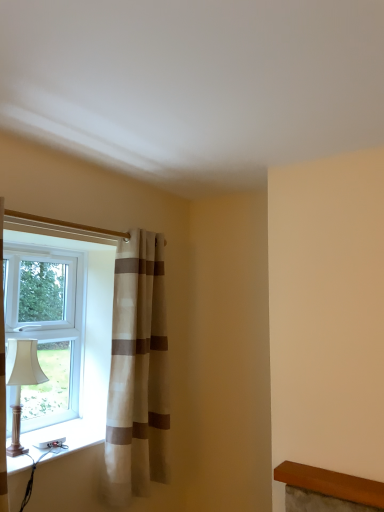
The width and height of the screenshot is (384, 512). I want to click on white plastic window sill at lower left, so click(x=66, y=436).

The height and width of the screenshot is (512, 384). Identify the location of beige striped curtain at left. (138, 372).

Locate an element on the screen. The height and width of the screenshot is (512, 384). matte white lampshade at left is located at coordinates (21, 382).

Considering the points (156, 277) and (77, 346), which point is behind, point (156, 277) or point (77, 346)?

Point (77, 346)

Is white plastic window at left at the back of beige striped curtain at left?

Absolutely, beige striped curtain at left is directed away from white plastic window at left.

From a real-world perspective, is beige striped curtain at left under white plastic window at left?

Yes, from a real-world perspective, beige striped curtain at left is beneath white plastic window at left.

How different are the orientations of matte white lampshade at left and beige striped curtain at left in degrees?

The angular difference between matte white lampshade at left and beige striped curtain at left is 0.0033 degrees.

From the image's perspective, which is above, matte white lampshade at left or beige striped curtain at left?

beige striped curtain at left, from the image's perspective.

Considering the sizes of objects matte white lampshade at left and beige striped curtain at left in the image provided, who is bigger, matte white lampshade at left or beige striped curtain at left?

beige striped curtain at left is bigger.

Is matte white lampshade at left positioned with its back to beige striped curtain at left?

No.

Is white plastic window sill at lower left bigger or smaller than matte white lampshade at left?

Considering their sizes, white plastic window sill at lower left takes up less space than matte white lampshade at left.

Is point (51, 455) positioned in front of point (27, 353)?

That is True.

Is white plastic window sill at lower left situated inside matte white lampshade at left or outside?

The correct answer is: outside.

Is white plastic window sill at lower left turned away from matte white lampshade at left?

That's not correct — white plastic window sill at lower left is not looking away from matte white lampshade at left.

From a real-world perspective, is white plastic window sill at lower left under beige striped curtain at left?

Indeed, from a real-world perspective, white plastic window sill at lower left is positioned beneath beige striped curtain at left.

Is white plastic window sill at lower left aimed at beige striped curtain at left?

No, white plastic window sill at lower left is not facing towards beige striped curtain at left.

Is white plastic window sill at lower left further to the viewer compared to beige striped curtain at left?

No, white plastic window sill at lower left is in front of beige striped curtain at left.

Considering the positions of objects white plastic window sill at lower left and beige striped curtain at left in the image provided, who is more to the left, white plastic window sill at lower left or beige striped curtain at left?

From the viewer's perspective, white plastic window sill at lower left appears more on the left side.

From the image's perspective, does white plastic window sill at lower left appear higher than white plastic window at left?

No, from the image's perspective, white plastic window sill at lower left is not above white plastic window at left.

Is white plastic window sill at lower left wider than white plastic window at left?

Yes, white plastic window sill at lower left is wider than white plastic window at left.

In the image, there is a white plastic window sill at lower left. Identify the location of window above it (from the image's perspective). Image resolution: width=384 pixels, height=512 pixels. (62, 325).

Considering their positions, is matte white lampshade at left located in front of or behind white plastic window at left?

Visually, matte white lampshade at left is located in front of white plastic window at left.

The image size is (384, 512). Identify the location of window located on the left of matte white lampshade at left. (62, 325).

Which of these two, matte white lampshade at left or white plastic window at left, is smaller?

matte white lampshade at left is smaller.

From the image's perspective, is matte white lampshade at left above or below white plastic window at left?

From the image's perspective, matte white lampshade at left appears below white plastic window at left.

Are white plastic window at left and beige striped curtain at left located far from each other?

No, white plastic window at left is in close proximity to beige striped curtain at left.

From a real-world perspective, which is physically above, white plastic window at left or beige striped curtain at left?

In real-world perspective, white plastic window at left is above.

How different are the orientations of white plastic window at left and beige striped curtain at left in degrees?

The facing directions of white plastic window at left and beige striped curtain at left are 0.00238 degrees apart.

Which of these two, white plastic window at left or beige striped curtain at left, is smaller?

With smaller size is white plastic window at left.

Image resolution: width=384 pixels, height=512 pixels. What are the coordinates of `window that appears above the beige striped curtain at left (from the image's perspective)` in the screenshot? It's located at (62, 325).

Identify the location of curtain that is behind the matte white lampshade at left. Image resolution: width=384 pixels, height=512 pixels. (138, 372).

From the image, which object appears to be farther from beige striped curtain at left, matte white lampshade at left or white plastic window at left?

Based on the image, matte white lampshade at left appears to be further to beige striped curtain at left.

Considering their positions, is beige striped curtain at left positioned further to white plastic window sill at lower left than white plastic window at left?

Among the two, beige striped curtain at left is located further to white plastic window sill at lower left.

Estimate the real-world distances between objects in this image. Which object is closer to beige striped curtain at left, white plastic window at left or white plastic window sill at lower left?

white plastic window at left lies closer to beige striped curtain at left than the other object.

Looking at the image, which one is located further to matte white lampshade at left, beige striped curtain at left or white plastic window sill at lower left?

Based on the image, beige striped curtain at left appears to be further to matte white lampshade at left.

Based on the photo, looking at the image, which one is located closer to white plastic window at left, beige striped curtain at left or matte white lampshade at left?

The object closer to white plastic window at left is beige striped curtain at left.

Which object lies nearer to the anchor point white plastic window at left, beige striped curtain at left or white plastic window sill at lower left?

Based on the image, beige striped curtain at left appears to be nearer to white plastic window at left.

Looking at this image, which object lies further to the anchor point matte white lampshade at left, beige striped curtain at left or white plastic window at left?

beige striped curtain at left is further to matte white lampshade at left.

Which object lies nearer to the anchor point white plastic window sill at lower left, white plastic window at left or beige striped curtain at left?

Based on the image, white plastic window at left appears to be nearer to white plastic window sill at lower left.

The width and height of the screenshot is (384, 512). In order to click on table lamp between white plastic window at left and white plastic window sill at lower left in the up-down direction in this screenshot , I will do `click(21, 382)`.

Where is `window sill located between white plastic window at left and beige striped curtain at left in the left-right direction`? The image size is (384, 512). window sill located between white plastic window at left and beige striped curtain at left in the left-right direction is located at coordinates (66, 436).

You are a GUI agent. You are given a task and a screenshot of the screen. Output one action in this format:
    pyautogui.click(x=<x>, y=<y>)
    Task: Click on the table lamp situated between white plastic window at left and beige striped curtain at left from left to right
    The height and width of the screenshot is (512, 384).
    Given the screenshot: What is the action you would take?
    pyautogui.click(x=21, y=382)

What are the coordinates of `window sill between matte white lampshade at left and beige striped curtain at left from left to right` in the screenshot? It's located at (66, 436).